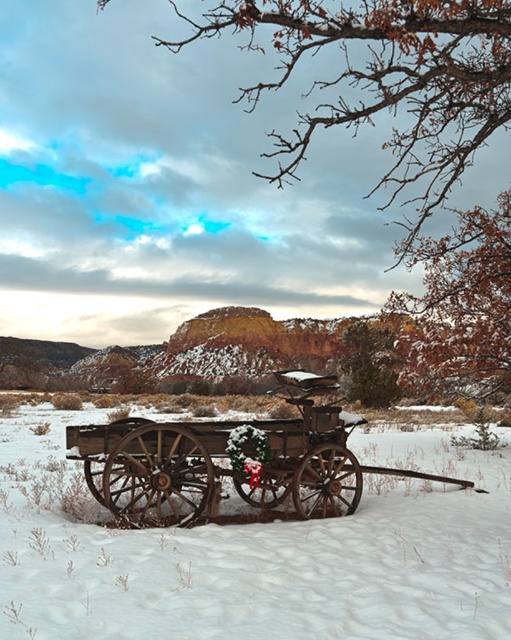
Question: Can you confirm if wooden wagon at center is thinner than rustic wood cart at center?

Choices:
 (A) yes
 (B) no

Answer: (B)

Question: Which of the following is the closest to the observer?

Choices:
 (A) rustic wood cart at center
 (B) wooden wagon at center

Answer: (B)

Question: Is wooden wagon at center thinner than rustic wood cart at center?

Choices:
 (A) yes
 (B) no

Answer: (B)

Question: Does wooden wagon at center have a greater width compared to rustic wood cart at center?

Choices:
 (A) no
 (B) yes

Answer: (B)